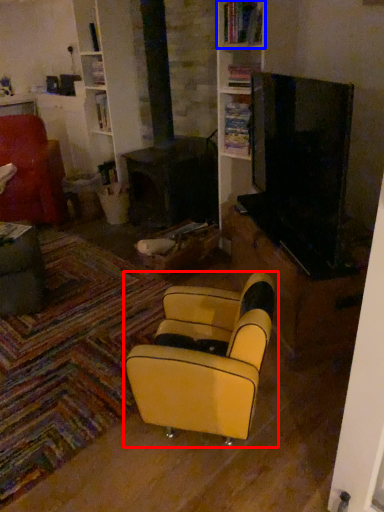
Question: Which point is further to the camera, chair (highlighted by a red box) or shelf (highlighted by a blue box)?

Choices:
 (A) chair
 (B) shelf

Answer: (B)